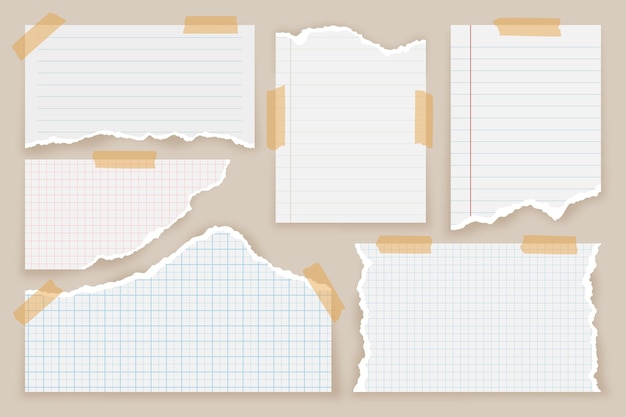
The height and width of the screenshot is (417, 626). I want to click on pieces of paper, so click(x=506, y=87), click(x=341, y=107), click(x=126, y=72), click(x=93, y=195), click(x=196, y=344), click(x=407, y=354).